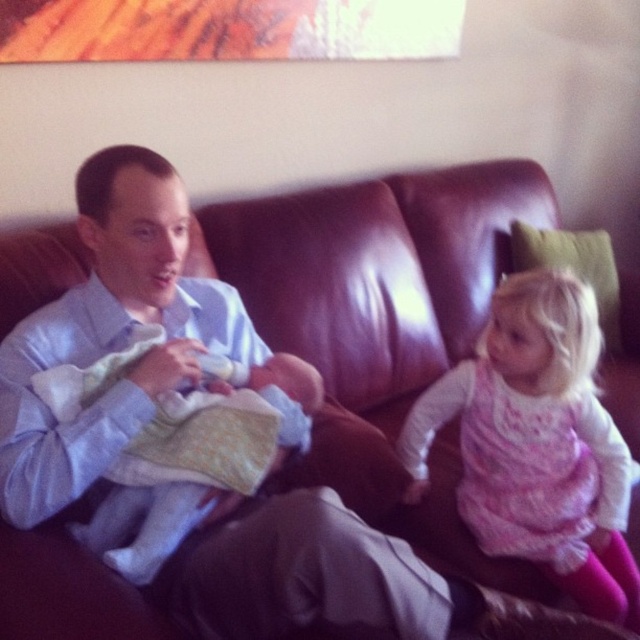
You are a fashion designer who needs to decide which item to display first in a showcase. Based on their sizes, which item should you choose between the pink fluffy dress at right and the soft white cloth at center?

The pink fluffy dress at right is taller than the soft white cloth at center, so you should choose the pink fluffy dress at right to display first because it is larger in height.

You are a fashion designer who wants to create a new outfit using the pink fluffy dress at right and the soft white cloth at center. Which material should you choose if you want to make a larger garment?

The pink fluffy dress at right has a larger size compared to the soft white cloth at center, so you should choose the pink fluffy dress at right to make a larger garment.